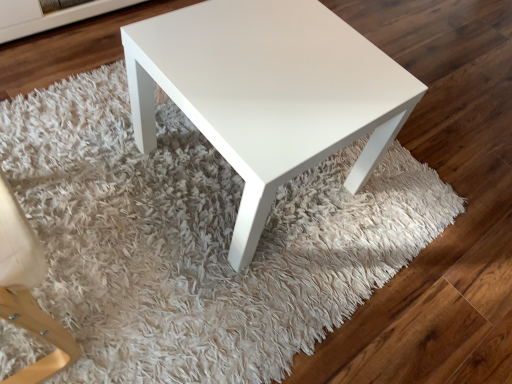
I want to click on vacant space to the right of white glossy table at center, so click(x=383, y=214).